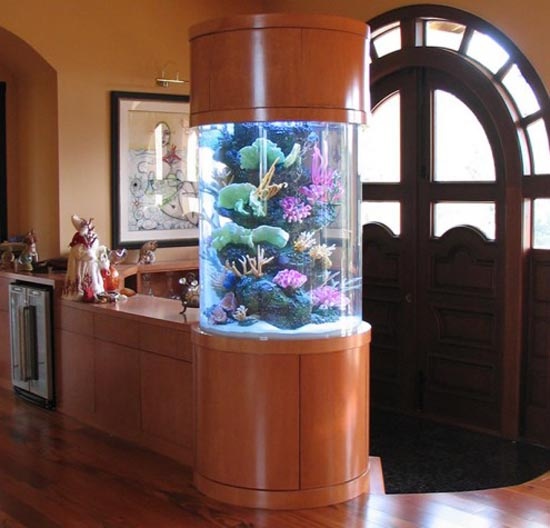
Where is `ornament`? The width and height of the screenshot is (550, 528). ornament is located at coordinates (82, 261).